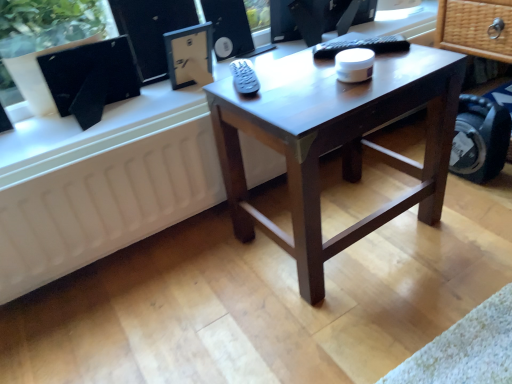
Question: Is matte dark brown coffee table at center taller than black matte computer monitor at upper left?

Choices:
 (A) yes
 (B) no

Answer: (A)

Question: Is matte dark brown coffee table at center wider than black matte computer monitor at upper left?

Choices:
 (A) yes
 (B) no

Answer: (A)

Question: From a real-world perspective, is matte dark brown coffee table at center below black matte computer monitor at upper left?

Choices:
 (A) no
 (B) yes

Answer: (B)

Question: Considering the relative sizes of matte dark brown coffee table at center and black matte computer monitor at upper left in the image provided, is matte dark brown coffee table at center bigger than black matte computer monitor at upper left?

Choices:
 (A) yes
 (B) no

Answer: (A)

Question: Can you confirm if matte dark brown coffee table at center is thinner than black matte computer monitor at upper left?

Choices:
 (A) yes
 (B) no

Answer: (B)

Question: Looking at their shapes, would you say matte dark brown coffee table at center is wider or thinner than black matte computer monitor at upper left?

Choices:
 (A) wide
 (B) thin

Answer: (A)

Question: In terms of height, does matte dark brown coffee table at center look taller or shorter compared to black matte computer monitor at upper left?

Choices:
 (A) tall
 (B) short

Answer: (A)

Question: Considering their positions, is matte dark brown coffee table at center located in front of or behind black matte computer monitor at upper left?

Choices:
 (A) front
 (B) behind

Answer: (A)

Question: From the image's perspective, is matte dark brown coffee table at center positioned above or below black matte computer monitor at upper left?

Choices:
 (A) below
 (B) above

Answer: (A)

Question: In terms of size, does white matte radiator at lower left appear bigger or smaller than matte black speaker at upper center?

Choices:
 (A) small
 (B) big

Answer: (B)

Question: From the image's perspective, is white matte radiator at lower left located above or below matte black speaker at upper center?

Choices:
 (A) below
 (B) above

Answer: (A)

Question: Is white matte radiator at lower left in front of or behind matte black speaker at upper center in the image?

Choices:
 (A) behind
 (B) front

Answer: (B)

Question: Visually, is white matte radiator at lower left positioned to the left or to the right of matte black speaker at upper center?

Choices:
 (A) left
 (B) right

Answer: (A)

Question: From a real-world perspective, is black matte computer monitor at upper left positioned above or below matte black speaker at upper center?

Choices:
 (A) above
 (B) below

Answer: (B)

Question: In the image, is black matte computer monitor at upper left positioned in front of or behind matte black speaker at upper center?

Choices:
 (A) front
 (B) behind

Answer: (A)